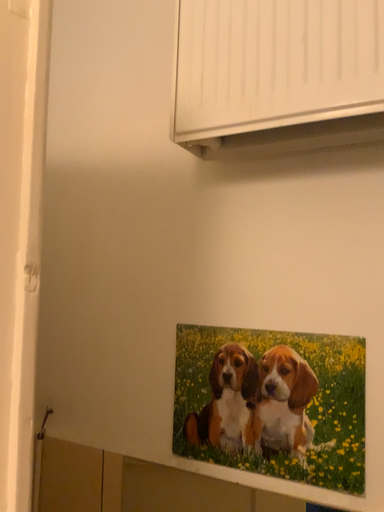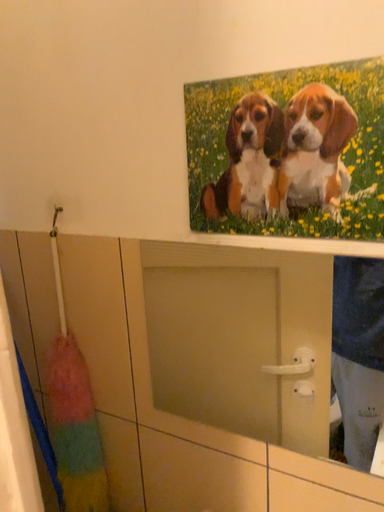
Question: Which way did the camera rotate in the video?

Choices:
 (A) rotated downward
 (B) rotated upward

Answer: (A)